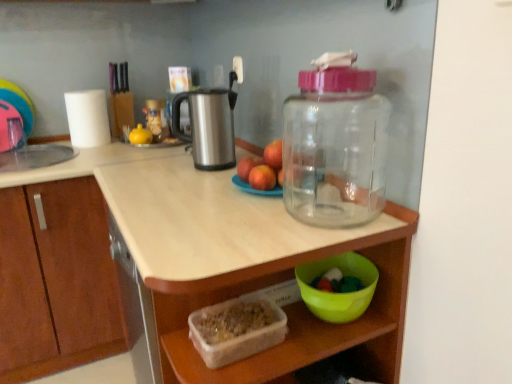
Image resolution: width=512 pixels, height=384 pixels. I want to click on vacant area that is in front of transparent plastic bottle at upper right, so click(x=317, y=240).